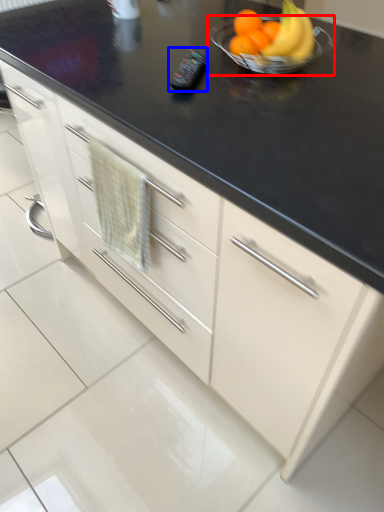
Question: Which of the following is the farthest to the observer, glass bowl (highlighted by a red box) or appliance (highlighted by a blue box)?

Choices:
 (A) glass bowl
 (B) appliance

Answer: (B)